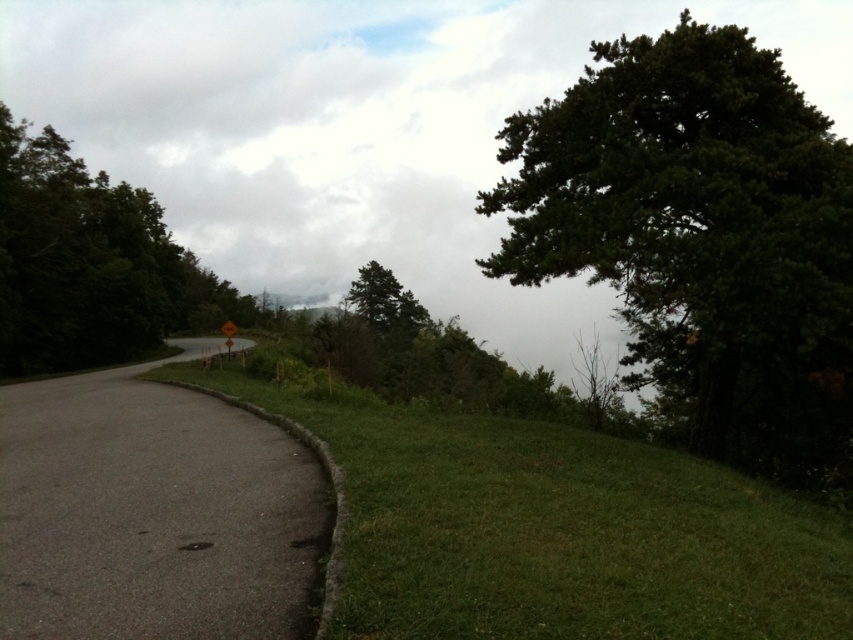
Can you confirm if green grassy at lower left is shorter than green matte tree at center?

Yes, green grassy at lower left is shorter than green matte tree at center.

How distant is green grassy at lower left from green matte tree at center?

63.77 meters

Locate an element on the screen. This screenshot has height=640, width=853. green grassy at lower left is located at coordinates (553, 529).

Can you confirm if green leafy tree at left is positioned above green matte tree at center?

No.

Does point (129, 260) come farther from viewer compared to point (390, 340)?

No, (129, 260) is closer to viewer.

You are a GUI agent. You are given a task and a screenshot of the screen. Output one action in this format:
    pyautogui.click(x=<x>, y=<y>)
    Task: Click on the green leafy tree at left
    
    Given the screenshot: What is the action you would take?
    pyautogui.click(x=90, y=264)

Between gray asphalt road at left and green leafy tree at left, which one appears on the left side from the viewer's perspective?

green leafy tree at left

Is point (4, 552) behind point (114, 276)?

No, (4, 552) is closer to viewer.

Where is `gray asphalt road at left`? This screenshot has width=853, height=640. gray asphalt road at left is located at coordinates (152, 513).